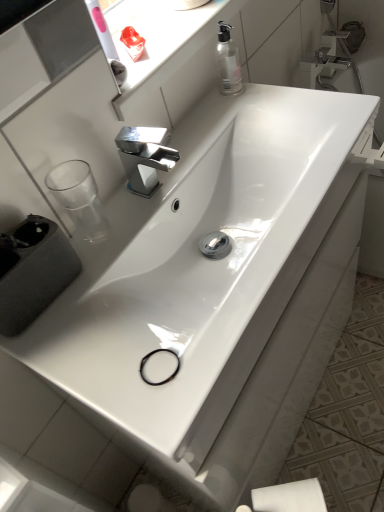
Question: Can you confirm if white glossy sink at center, which is the second sink from back to front, is smaller than polished chrome faucet at center?

Choices:
 (A) yes
 (B) no

Answer: (B)

Question: From the image's perspective, would you say white glossy sink at center, the first sink viewed from the front, is shown under polished chrome faucet at center?

Choices:
 (A) yes
 (B) no

Answer: (A)

Question: Does white glossy sink at center, the first sink viewed from the front, turn towards polished chrome faucet at center?

Choices:
 (A) no
 (B) yes

Answer: (A)

Question: Can you confirm if white glossy sink at center, which is the second sink from back to front, is thinner than polished chrome faucet at center?

Choices:
 (A) no
 (B) yes

Answer: (A)

Question: Is white glossy sink at center, which is the second sink from back to front, positioned before polished chrome faucet at center?

Choices:
 (A) yes
 (B) no

Answer: (A)

Question: Does white glossy sink at center, which is the second sink from back to front, have a larger size compared to polished chrome faucet at center?

Choices:
 (A) yes
 (B) no

Answer: (A)

Question: Does white matte toilet paper at lower right have a smaller size compared to polished chrome faucet at center?

Choices:
 (A) yes
 (B) no

Answer: (B)

Question: Does white matte toilet paper at lower right have a lesser height compared to polished chrome faucet at center?

Choices:
 (A) yes
 (B) no

Answer: (B)

Question: Can you confirm if white matte toilet paper at lower right is thinner than polished chrome faucet at center?

Choices:
 (A) no
 (B) yes

Answer: (B)

Question: Is white matte toilet paper at lower right with polished chrome faucet at center?

Choices:
 (A) yes
 (B) no

Answer: (B)

Question: Considering the relative positions of white matte toilet paper at lower right and polished chrome faucet at center in the image provided, is white matte toilet paper at lower right in front of polished chrome faucet at center?

Choices:
 (A) no
 (B) yes

Answer: (B)

Question: Considering the relative sizes of white matte toilet paper at lower right and polished chrome faucet at center in the image provided, is white matte toilet paper at lower right wider than polished chrome faucet at center?

Choices:
 (A) no
 (B) yes

Answer: (A)

Question: Does white glossy sink at center, which is the second sink from back to front, have a lesser width compared to white glossy sink at center, arranged as the 1th sink when viewed from the back?

Choices:
 (A) yes
 (B) no

Answer: (B)